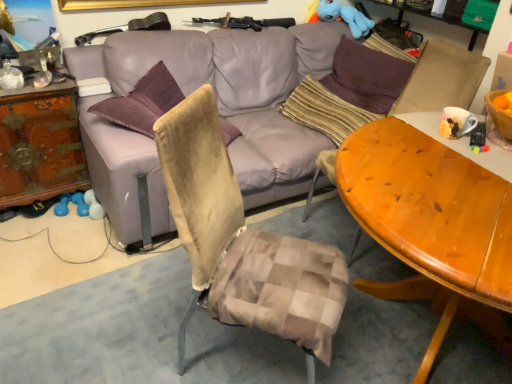
Locate an element on the screen. The height and width of the screenshot is (384, 512). purple fabric pillow at upper right, which appears as the first pillow when viewed from the right is located at coordinates (367, 76).

What is the approximate height of translucent glass bottle at upper left?

It is 3.79 inches.

The width and height of the screenshot is (512, 384). Find the location of `purple fabric pillow at upper right, which appears as the first pillow when viewed from the right`. purple fabric pillow at upper right, which appears as the first pillow when viewed from the right is located at coordinates (367, 76).

Is wooden carved dresser at left in front of or behind purple leather couch at center in the image?

Visually, wooden carved dresser at left is located behind purple leather couch at center.

Which of these two, wooden carved dresser at left or purple leather couch at center, is smaller?

wooden carved dresser at left.

Is wooden carved dresser at left wider than purple leather couch at center?

Incorrect, the width of wooden carved dresser at left does not surpass that of purple leather couch at center.

From the picture: From the image's perspective, is purple fabric pillow at upper right, which is the second pillow from left to right, above or below striped fabric pillow at center, arranged as the 1th pillow when viewed from the left?

Based on their image positions, purple fabric pillow at upper right, which is the second pillow from left to right, is located above striped fabric pillow at center, arranged as the 1th pillow when viewed from the left.

Can you confirm if purple fabric pillow at upper right, which appears as the first pillow when viewed from the right, is taller than striped fabric pillow at center, which is the second pillow from right to left?

Correct, purple fabric pillow at upper right, which appears as the first pillow when viewed from the right, is much taller as striped fabric pillow at center, which is the second pillow from right to left.

Which of these two, purple fabric pillow at upper right, which is the second pillow from left to right, or striped fabric pillow at center, which is the second pillow from right to left, is thinner?

With smaller width is striped fabric pillow at center, which is the second pillow from right to left.

Which is more to the left, purple fabric pillow at upper right, which is the second pillow from left to right, or striped fabric pillow at center, arranged as the 1th pillow when viewed from the left?

striped fabric pillow at center, arranged as the 1th pillow when viewed from the left, is more to the left.

Are translucent glass bottle at upper left and wooden carved dresser at left making contact?

No, translucent glass bottle at upper left is not next to wooden carved dresser at left.

Is translucent glass bottle at upper left turned away from wooden carved dresser at left?

No, wooden carved dresser at left is not at the back of translucent glass bottle at upper left.

Considering the sizes of translucent glass bottle at upper left and wooden carved dresser at left in the image, is translucent glass bottle at upper left bigger or smaller than wooden carved dresser at left?

Considering their sizes, translucent glass bottle at upper left takes up less space than wooden carved dresser at left.

From a real-world perspective, which object rests below the other?

In real-world perspective, wooden carved dresser at left is lower.

Considering the positions of objects wooden carved dresser at left and brown fabric swivel chair at right in the image provided, who is more to the right, wooden carved dresser at left or brown fabric swivel chair at right?

brown fabric swivel chair at right.

From the image's perspective, between wooden carved dresser at left and brown fabric swivel chair at right, who is located below?

brown fabric swivel chair at right is shown below in the image.

Who is bigger, brown fabric swivel chair at right or wooden carved dresser at left?

Bigger between the two is brown fabric swivel chair at right.

Which point is more forward, (467, 101) or (46, 180)?

The point (467, 101) is in front.

Is brown fabric swivel chair at right not within wooden carved dresser at left?

brown fabric swivel chair at right is positioned outside wooden carved dresser at left.

Consider the image. Relative to wooden carved dresser at left, is brown fabric swivel chair at right in front or behind?

brown fabric swivel chair at right is in front of wooden carved dresser at left.

Are matte ceramic mug at upper right and blue plush toy at upper right beside each other?

No, matte ceramic mug at upper right is not touching blue plush toy at upper right.

Considering the relative sizes of matte ceramic mug at upper right and blue plush toy at upper right in the image provided, is matte ceramic mug at upper right thinner than blue plush toy at upper right?

Yes.

What's the angular difference between matte ceramic mug at upper right and blue plush toy at upper right's facing directions?

matte ceramic mug at upper right and blue plush toy at upper right are facing 97.2 degrees away from each other.

Does point (465, 124) come behind point (313, 4)?

No, (465, 124) is in front of (313, 4).

The height and width of the screenshot is (384, 512). In order to click on coffee cup that is above the translucent glass bottle at upper left (from a real-world perspective) in this screenshot , I will do `click(456, 122)`.

Considering the sizes of objects translucent glass bottle at upper left and matte ceramic mug at upper right in the image provided, who is wider, translucent glass bottle at upper left or matte ceramic mug at upper right?

With larger width is matte ceramic mug at upper right.

From a real-world perspective, is translucent glass bottle at upper left under matte ceramic mug at upper right?

Yes, from a real-world perspective, translucent glass bottle at upper left is beneath matte ceramic mug at upper right.

Which is closer to the camera, (4, 88) or (465, 133)?

Point (4, 88).

In the image, there is a purple leather couch at center. At what (x,y) coordinates should I click in order to perform the action: click on table below it (from the image's perspective). Please return your answer as a coordinate pair (x, y). The image size is (512, 384). Looking at the image, I should click on (40, 144).

Identify the location of pillow that is above the striped fabric pillow at center, which is the second pillow from right to left (from the image's perspective). (367, 76).

Estimate the real-world distances between objects in this image. Which object is further from matte ceramic mug at upper right, blue plush toy at upper right or striped fabric pillow at center, which is the second pillow from right to left?

The object further to matte ceramic mug at upper right is blue plush toy at upper right.

From the image, which object appears to be farther from striped fabric pillow at center, which is the second pillow from right to left, matte ceramic mug at upper right or brown fabric swivel chair at right?

matte ceramic mug at upper right is further to striped fabric pillow at center, which is the second pillow from right to left.

Looking at the image, which one is located further to wooden carved dresser at left, wooden table at center or brown fabric swivel chair at right?

brown fabric swivel chair at right.

Looking at the image, which one is located further to striped fabric pillow at center, arranged as the 1th pillow when viewed from the left, purple fabric pillow at upper right, which is the second pillow from left to right, or brown fabric swivel chair at right?

Based on the image, brown fabric swivel chair at right appears to be further to striped fabric pillow at center, arranged as the 1th pillow when viewed from the left.

Based on the photo, looking at the image, which one is located closer to wooden table at center, matte ceramic mug at upper right or striped fabric pillow at center, arranged as the 1th pillow when viewed from the left?

matte ceramic mug at upper right lies closer to wooden table at center than the other object.

Estimate the real-world distances between objects in this image. Which object is closer to purple leather couch at center, matte ceramic mug at upper right or translucent glass bottle at upper left?

Based on the image, translucent glass bottle at upper left appears to be nearer to purple leather couch at center.

From the picture: When comparing their distances from matte ceramic mug at upper right, does blue plush toy at upper right or brown fabric swivel chair at right seem closer?

brown fabric swivel chair at right is positioned closer to the anchor matte ceramic mug at upper right.

Which object lies further to the anchor point matte ceramic mug at upper right, translucent glass bottle at upper left or wooden table at center?

Based on the image, translucent glass bottle at upper left appears to be further to matte ceramic mug at upper right.

Find the location of `desk situated between wooden carved dresser at left and brown fabric swivel chair at right from left to right`. desk situated between wooden carved dresser at left and brown fabric swivel chair at right from left to right is located at coordinates (432, 226).

Locate an element on the screen. The height and width of the screenshot is (384, 512). desk between wooden carved dresser at left and matte ceramic mug at upper right from left to right is located at coordinates (432, 226).

This screenshot has width=512, height=384. What are the coordinates of `studio couch between wooden carved dresser at left and blue plush toy at upper right` in the screenshot? It's located at (131, 131).

The height and width of the screenshot is (384, 512). I want to click on coffee cup between brown fabric swivel chair at right and purple fabric pillow at upper right, which appears as the first pillow when viewed from the right, along the z-axis, so click(x=456, y=122).